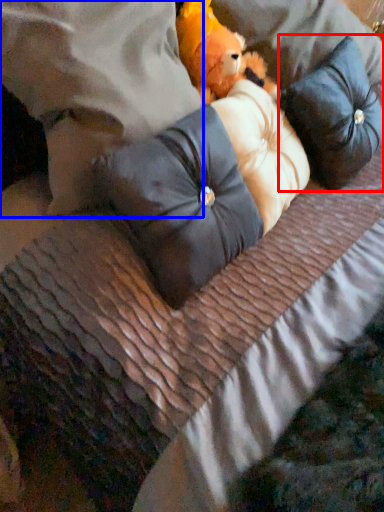
Question: Which of the following is the farthest to the observer, pillow (highlighted by a red box) or pillow (highlighted by a blue box)?

Choices:
 (A) pillow
 (B) pillow

Answer: (A)